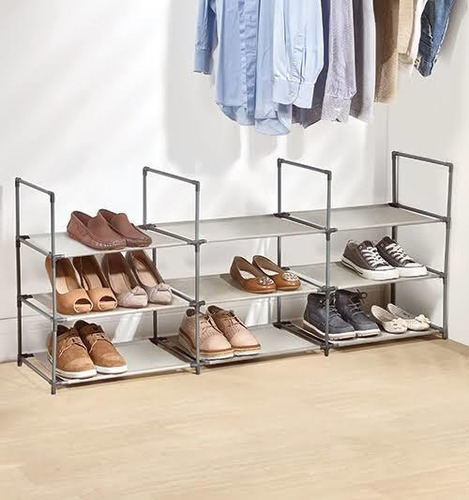
Locate an element on the screen. The image size is (469, 500). shelving racks is located at coordinates (125, 240), (126, 306), (137, 355), (234, 349), (229, 283), (235, 233), (366, 217), (385, 269), (393, 314).